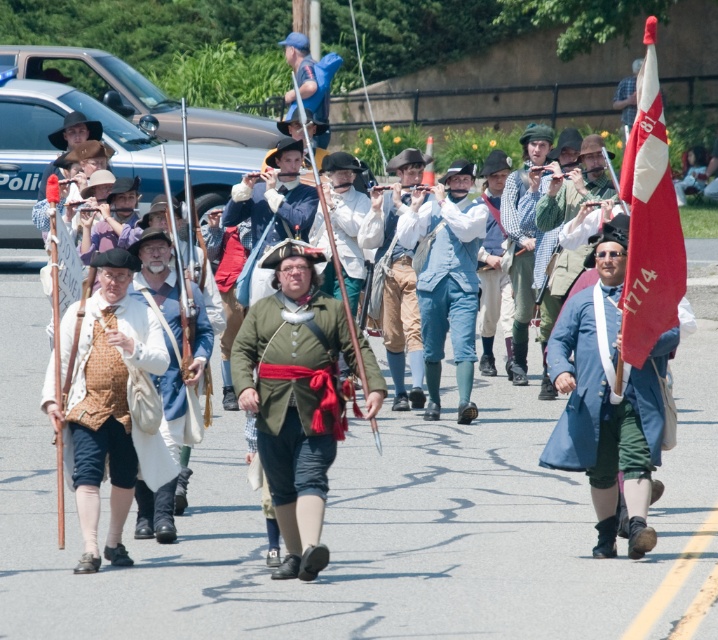
Question: Which object appears closest to the camera in this image?

Choices:
 (A) matte brown vest at center
 (B) checkered fabric shirt at center
 (C) green fabric coat at center
 (D) blue fabric coat at center

Answer: (C)

Question: Which object appears closest to the camera in this image?

Choices:
 (A) blue fabric coat at center
 (B) matte brown vest at center
 (C) red fabric flag at right
 (D) checkered fabric shirt at center

Answer: (C)

Question: Is green fabric coat at center to the left of checkered fabric shirt at center from the viewer's perspective?

Choices:
 (A) yes
 (B) no

Answer: (A)

Question: Which object appears farthest from the camera in this image?

Choices:
 (A) checkered fabric shirt at center
 (B) green fabric coat at center

Answer: (A)

Question: Is blue fabric coat at center smaller than matte brown vest at center?

Choices:
 (A) no
 (B) yes

Answer: (A)

Question: Is green fabric coat at center further to camera compared to blue fabric coat at center?

Choices:
 (A) no
 (B) yes

Answer: (A)